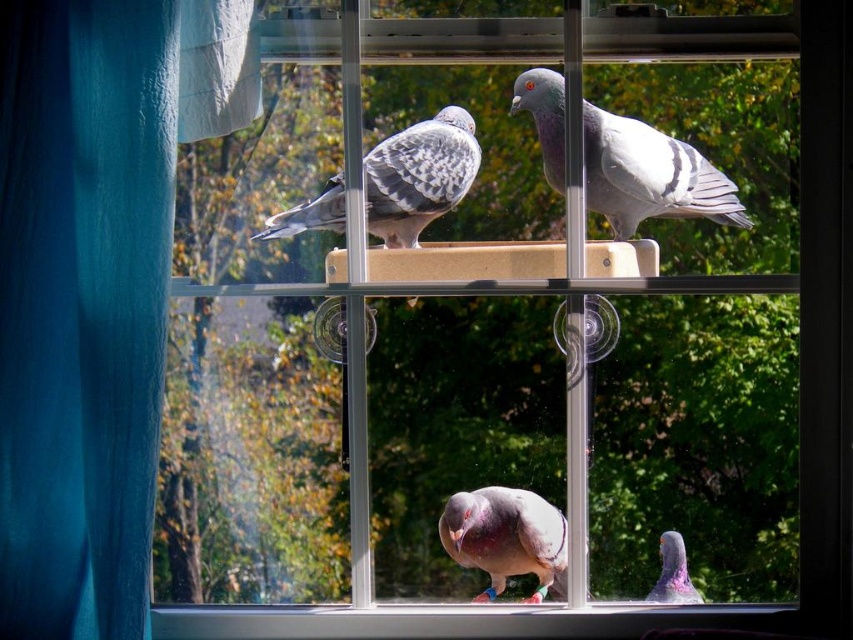
Question: Does teal fabric curtain at left lie behind purple-gray pigeon at lower right?

Choices:
 (A) yes
 (B) no

Answer: (B)

Question: Which object appears farthest from the camera in this image?

Choices:
 (A) pinkish-gray feathered pigeon at lower center
 (B) gray speckled pigeon at upper center

Answer: (B)

Question: Which point is farther to the camera?

Choices:
 (A) gray speckled pigeon at upper center
 (B) purple-gray pigeon at lower right

Answer: (B)

Question: Can you confirm if teal fabric curtain at left is bigger than speckled feathered pigeon at upper left?

Choices:
 (A) no
 (B) yes

Answer: (B)

Question: Which point appears closest to the camera in this image?

Choices:
 (A) (467, 129)
 (B) (695, 600)
 (C) (32, 77)
 (D) (689, 172)

Answer: (C)

Question: Is the position of teal fabric curtain at left less distant than that of speckled feathered pigeon at upper left?

Choices:
 (A) yes
 (B) no

Answer: (A)